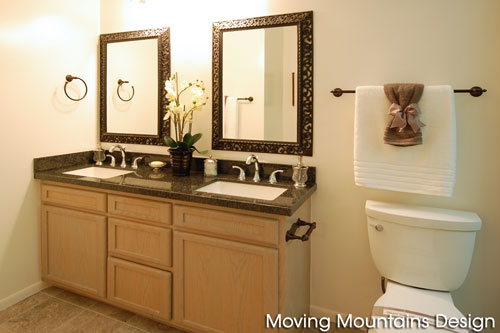
This screenshot has width=500, height=333. Identify the location of mirrors. (261, 65), (158, 61).